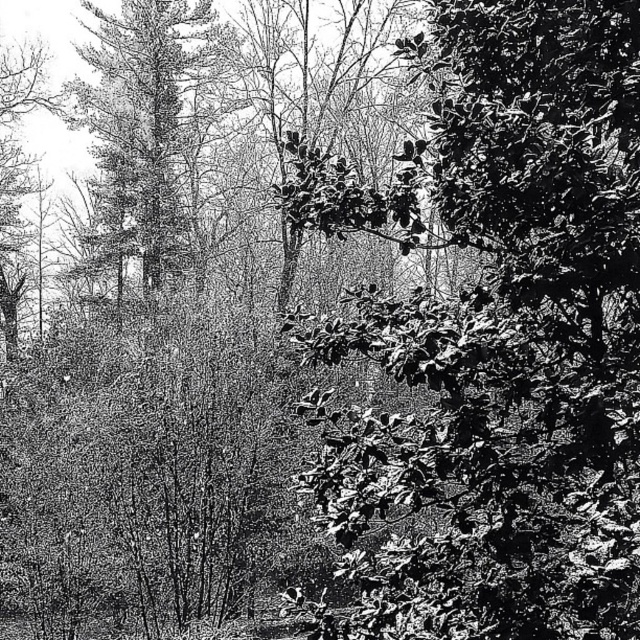
This screenshot has height=640, width=640. What do you see at coordinates (493, 336) in the screenshot?
I see `shiny green leaves at center` at bounding box center [493, 336].

Does shiny green leaves at center have a greater width compared to smooth bark tree at left?

No.

Where is `shiny green leaves at center`? shiny green leaves at center is located at coordinates (493, 336).

Where is `shiny green leaves at center`? shiny green leaves at center is located at coordinates (493, 336).